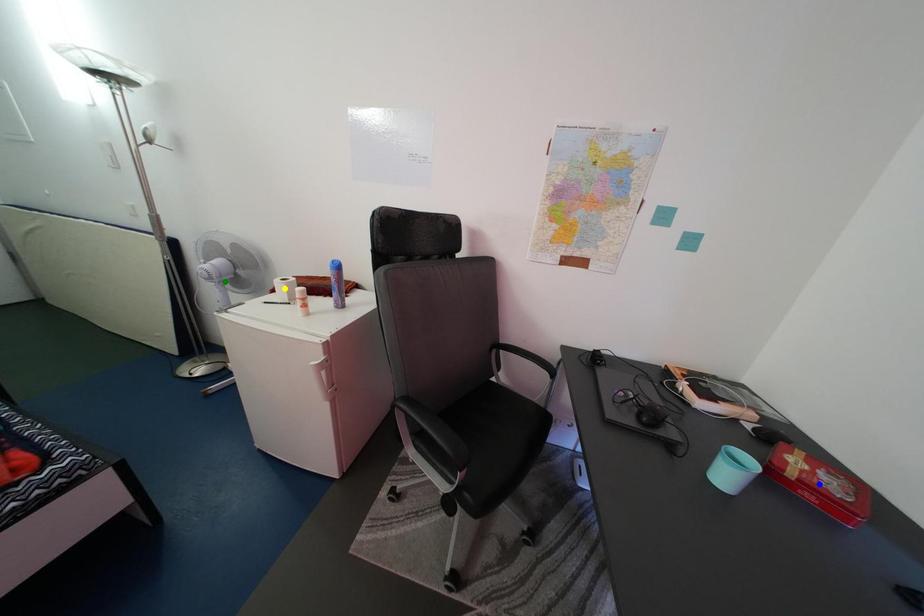
Order these from nearest to farthest:
green point, blue point, yellow point

1. blue point
2. yellow point
3. green point